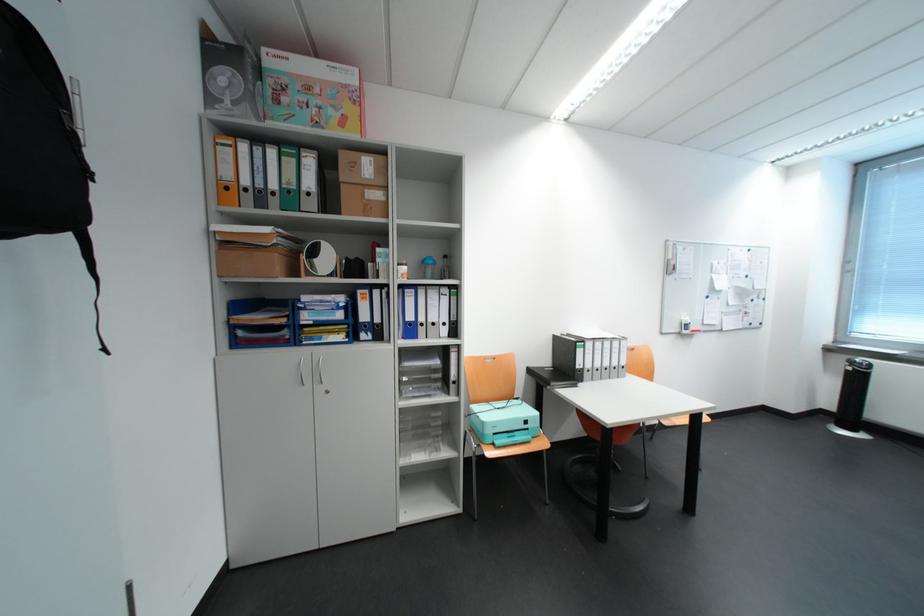
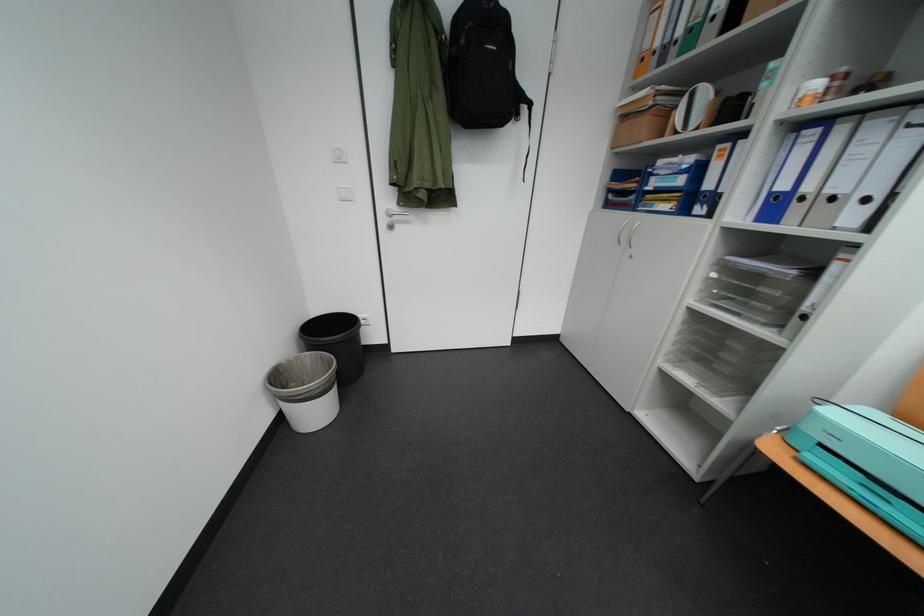
Locate, in the second image, the point that corresponds to point 457,455 in the first image.

(730, 403)